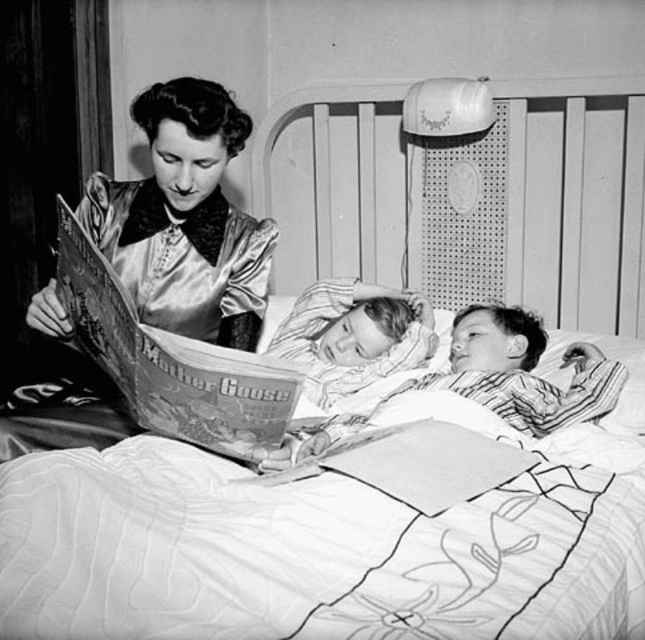
You are a photographer analyzing the composition of this black and white photo. You notice the silky satin dress at upper left and the printed paper book at left. Which object is positioned more to the left side of the image?

The silky satin dress at upper left is positioned more to the left than the printed paper book at left according to the description.

You are a photographer analyzing the composition of this black and white photo. The image has a point at coordinates (x=184, y=218). What object is located at that point?

The point at coordinates (x=184, y=218) corresponds to the silky satin dress at upper left.

From the picture: You are a photographer analyzing the composition of this black and white photo. You notice the silky satin dress at upper left and the printed paper book at left. Which object is closer to your viewpoint?

The silky satin dress at upper left is closer to the viewer than the printed paper book at left.